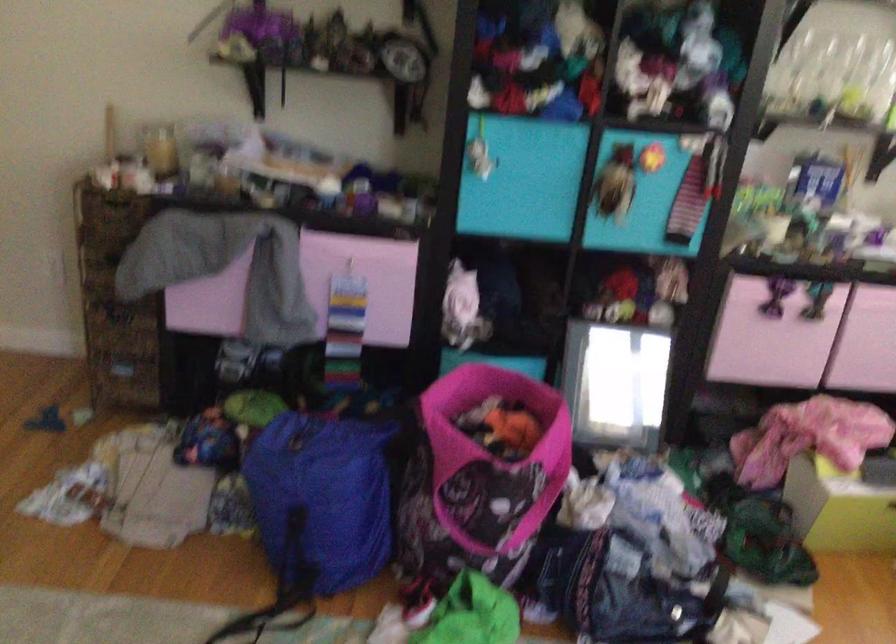
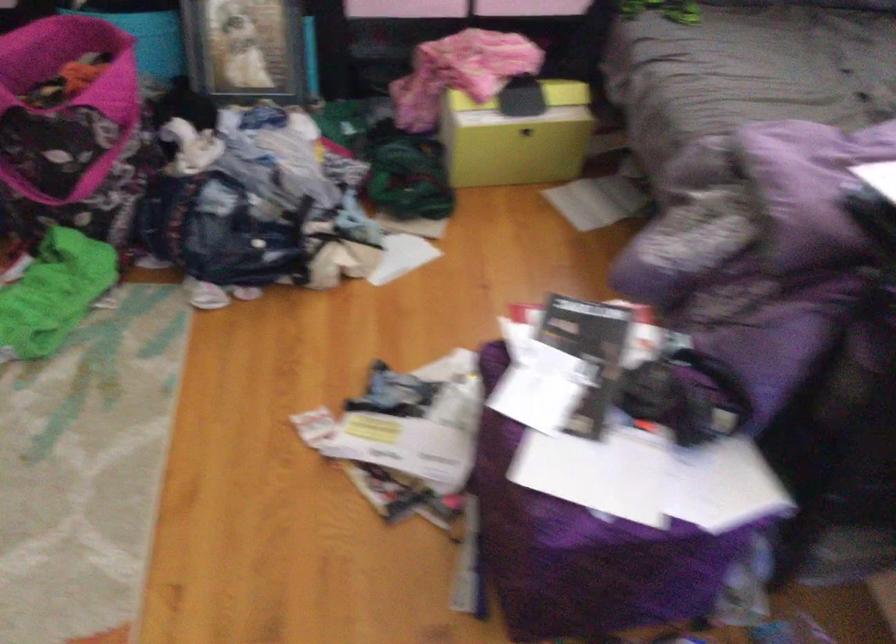
Question: The images are taken continuously from a first-person perspective. In which direction are you moving?

Choices:
 (A) Left
 (B) Right
 (C) Forward
 (D) Backward

Answer: (B)